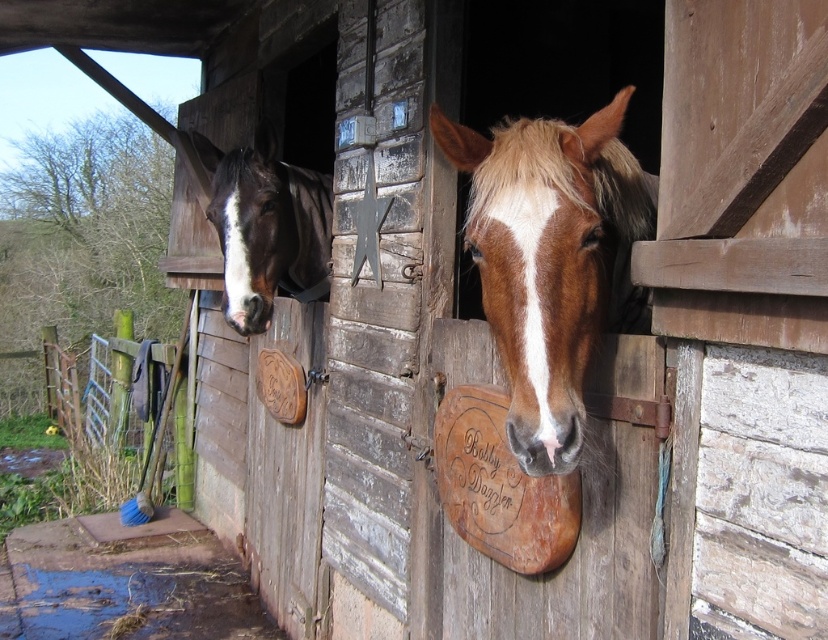
Between brown glossy horse at center and brown glossy horse at left, which one has more height?

Standing taller between the two is brown glossy horse at left.

You are a GUI agent. You are given a task and a screenshot of the screen. Output one action in this format:
    pyautogui.click(x=<x>, y=<y>)
    Task: Click on the brown glossy horse at center
    The width and height of the screenshot is (828, 640).
    Given the screenshot: What is the action you would take?
    pyautogui.click(x=547, y=259)

Image resolution: width=828 pixels, height=640 pixels. I want to click on brown glossy horse at center, so click(547, 259).